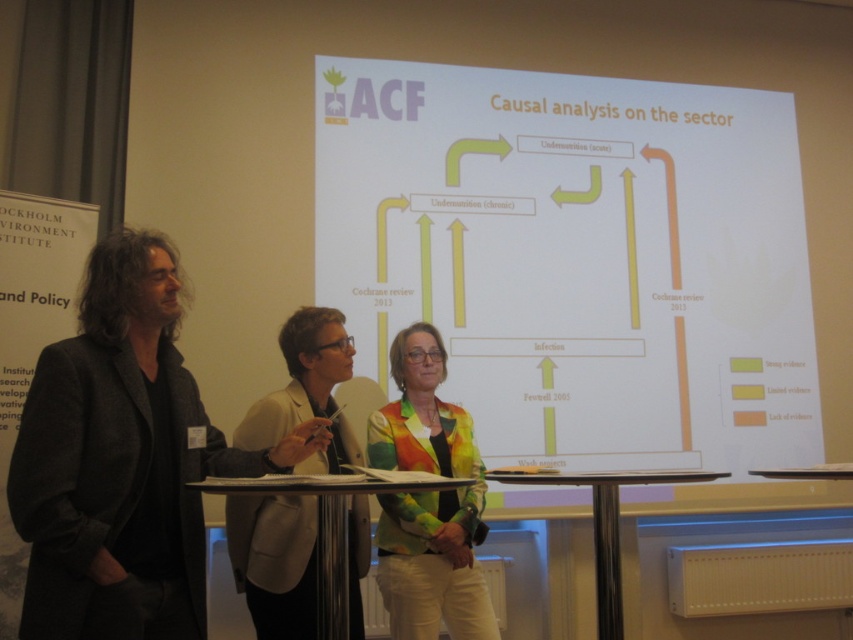
Is metallic silver table at center in front of metallic polished table at center?

Yes, metallic silver table at center is in front of metallic polished table at center.

Can you confirm if metallic silver table at center is positioned above metallic polished table at center?

Indeed, metallic silver table at center is positioned over metallic polished table at center.

Is point (329, 538) closer to camera compared to point (601, 564)?

That is True.

The image size is (853, 640). Identify the location of metallic silver table at center. (329, 522).

Is point (433, 445) in front of point (334, 540)?

No, (433, 445) is behind (334, 540).

What do you see at coordinates (428, 500) in the screenshot? The image size is (853, 640). I see `rainbow fabric jacket at center` at bounding box center [428, 500].

Where is `rainbow fabric jacket at center`? The height and width of the screenshot is (640, 853). rainbow fabric jacket at center is located at coordinates (428, 500).

Does dark gray woolen jacket at left have a lesser width compared to rainbow fabric jacket at center?

No.

Who is lower down, dark gray woolen jacket at left or rainbow fabric jacket at center?

rainbow fabric jacket at center

Who is more forward, (172, 401) or (426, 628)?

Point (172, 401)

This screenshot has width=853, height=640. Find the location of `dark gray woolen jacket at left`. dark gray woolen jacket at left is located at coordinates (123, 460).